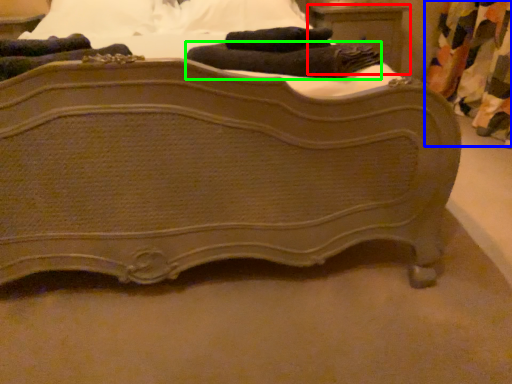
Question: Which object is positioned farthest from nightstand (highlighted by a red box)? Select from curtain (highlighted by a blue box) and bath towel (highlighted by a green box).

Choices:
 (A) curtain
 (B) bath towel

Answer: (B)